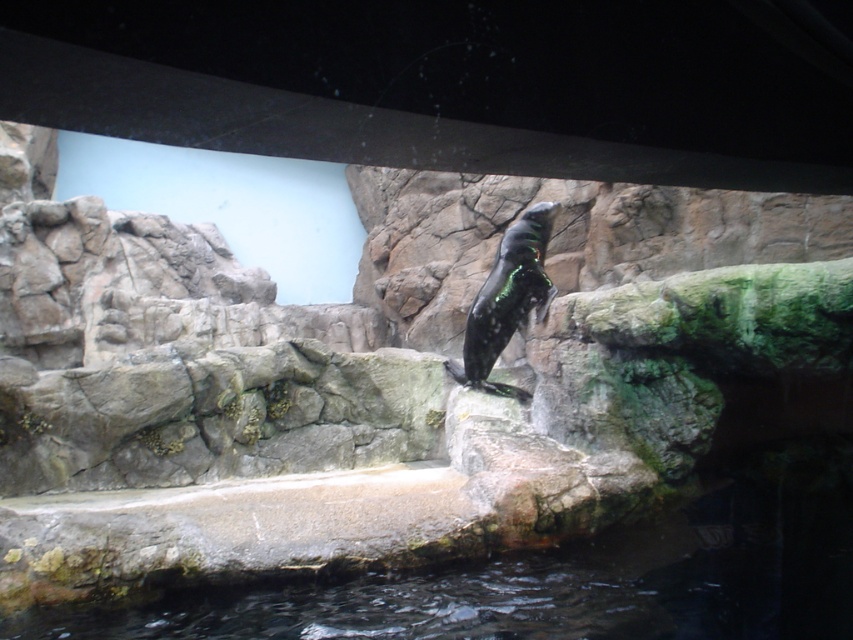
Can you confirm if clear water at lower center is positioned to the left of shiny black penguin at center?

Indeed, clear water at lower center is positioned on the left side of shiny black penguin at center.

Who is lower down, clear water at lower center or shiny black penguin at center?

clear water at lower center is below.

Locate an element on the screen. clear water at lower center is located at coordinates (553, 580).